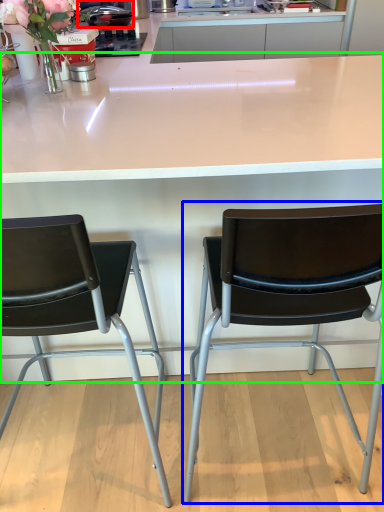
Question: Which is farther away from appliance (highlighted by a red box)? chair (highlighted by a blue box) or table (highlighted by a green box)?

Choices:
 (A) chair
 (B) table

Answer: (A)